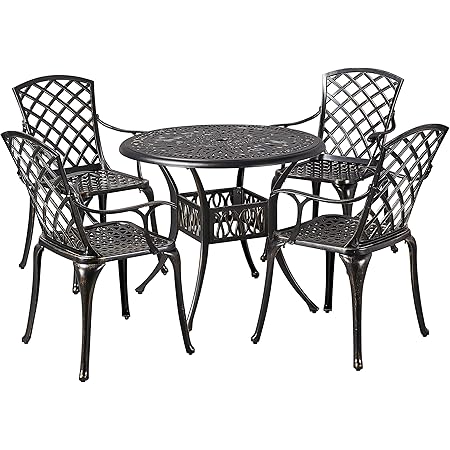
Where is `back left chair`? Image resolution: width=450 pixels, height=450 pixels. back left chair is located at coordinates point(100,171).